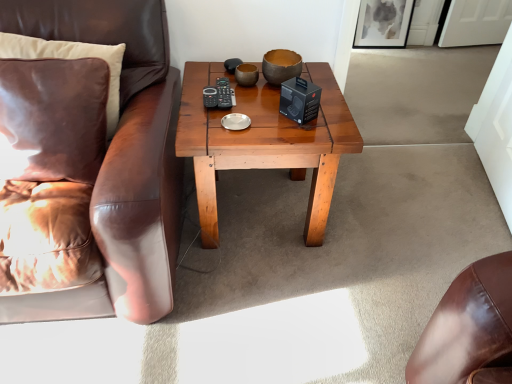
Question: Looking at their shapes, would you say brown leather chair at left is wider or thinner than matte gray painting at upper right?

Choices:
 (A) thin
 (B) wide

Answer: (B)

Question: From the image's perspective, is brown leather chair at left positioned above or below matte gray painting at upper right?

Choices:
 (A) below
 (B) above

Answer: (A)

Question: Which object is the closest to the suede pillow at left, which ranks as the 2th pillow in front-to-back order?

Choices:
 (A) matte gray painting at upper right
 (B) matte brown bowl at center
 (C) brown leather chair at left
 (D) wooden coffee table at center
 (E) velvet brown pillow at left, arranged as the 1th pillow when viewed from the front

Answer: (E)

Question: Which object is positioned closest to the velvet brown pillow at left, arranged as the 1th pillow when viewed from the front?

Choices:
 (A) matte brown bowl at center
 (B) suede pillow at left, which ranks as the 2th pillow in front-to-back order
 (C) wooden coffee table at center
 (D) brown leather chair at left
 (E) matte gray painting at upper right

Answer: (D)